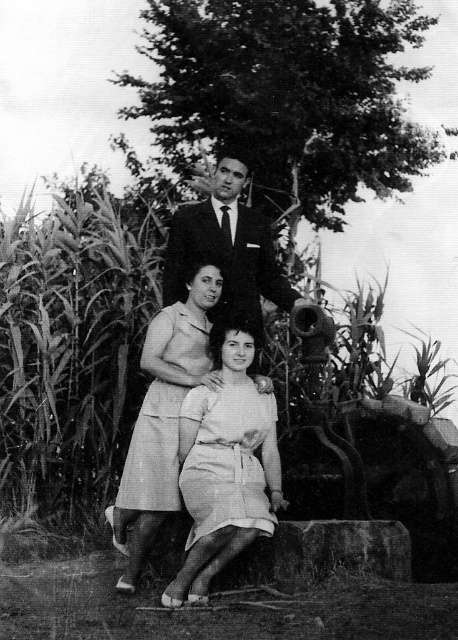
Identify the location of light beige fabric dress at center. (224, 470).

Describe the element at coordinates (224, 470) in the screenshot. Image resolution: width=458 pixels, height=640 pixels. I see `light beige fabric dress at center` at that location.

Between point (230, 396) and point (159, 396), which one is positioned behind?

Point (159, 396)

This screenshot has height=640, width=458. Find the location of `light beige fabric dress at center`. light beige fabric dress at center is located at coordinates (224, 470).

Is smooth fabric dress at center above smooth black suit at center?

No, smooth fabric dress at center is not above smooth black suit at center.

Based on the photo, measure the distance between smooth fabric dress at center and camera.

smooth fabric dress at center and camera are 22.22 feet apart from each other.

Who is more forward, (116,538) or (235,234)?

Positioned in front is point (116,538).

Locate an element on the screen. Image resolution: width=458 pixels, height=640 pixels. smooth fabric dress at center is located at coordinates (194, 339).

Where is `light beige cotton dress at center`? The image size is (458, 640). light beige cotton dress at center is located at coordinates (163, 419).

Between light beige cotton dress at center and smooth black suit at center, which one appears on the left side from the viewer's perspective?

light beige cotton dress at center is more to the left.

Is point (147, 497) positioned in front of point (179, 221)?

That is True.

Where is `light beige cotton dress at center`? The image size is (458, 640). light beige cotton dress at center is located at coordinates (163, 419).